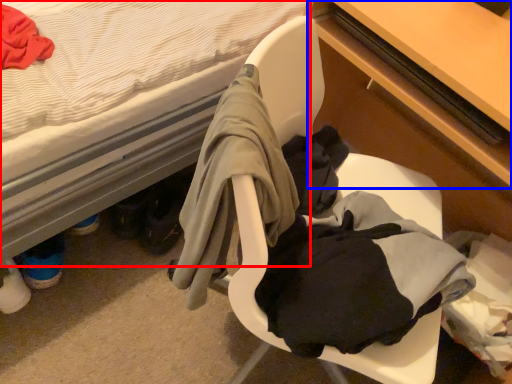
Question: Which object appears farthest to the camera in this image, bed (highlighted by a red box) or table (highlighted by a blue box)?

Choices:
 (A) bed
 (B) table

Answer: (B)